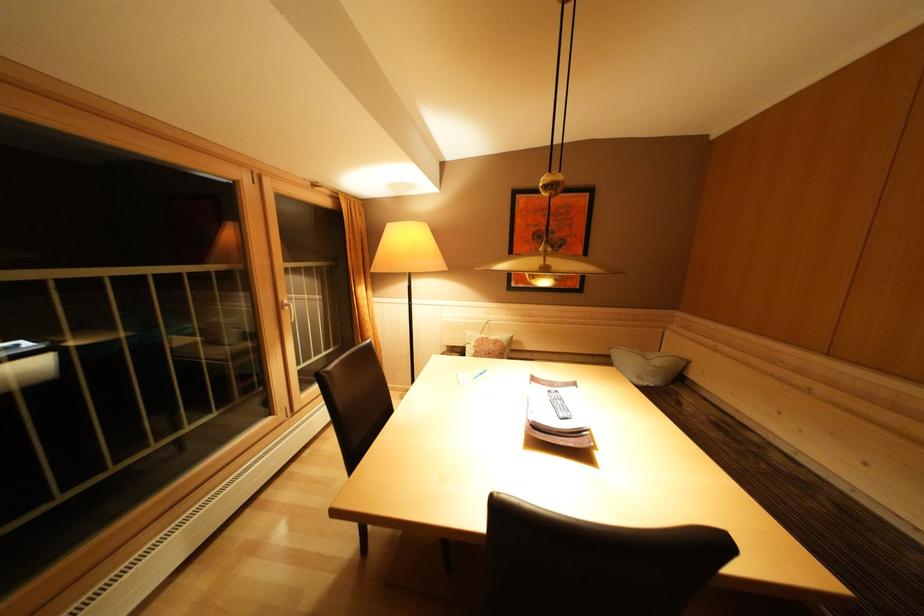
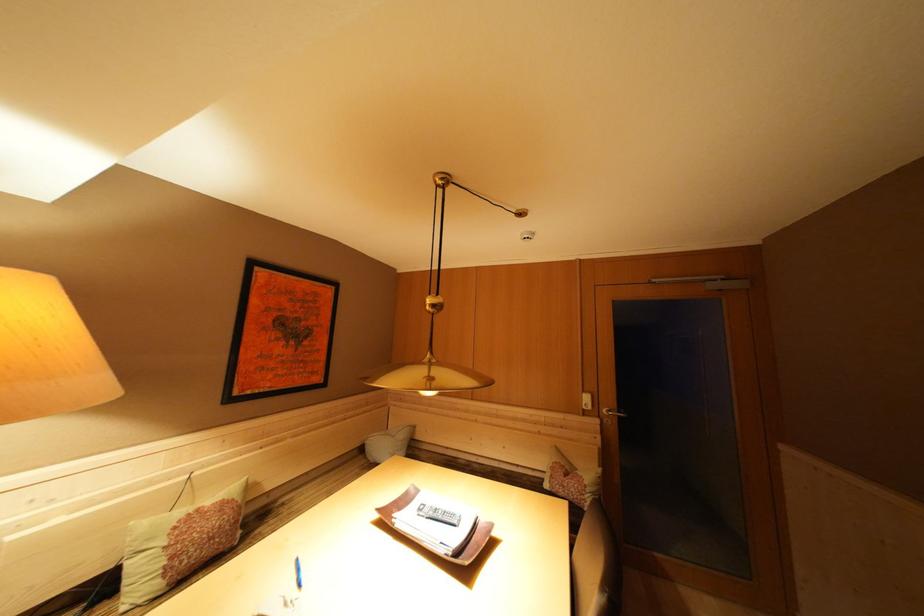
Where in the second image is the point corresponding to [493,342] from the first image?

(204, 515)